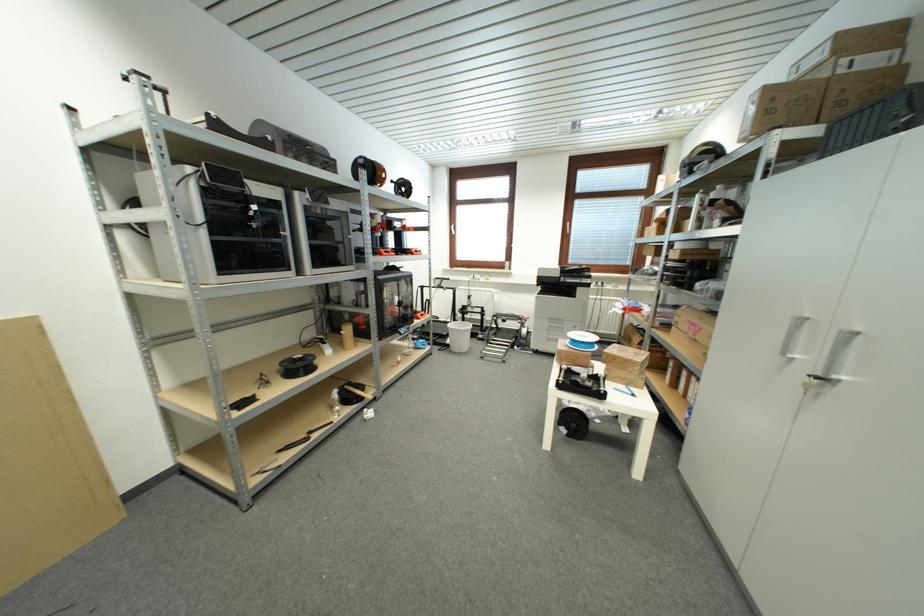
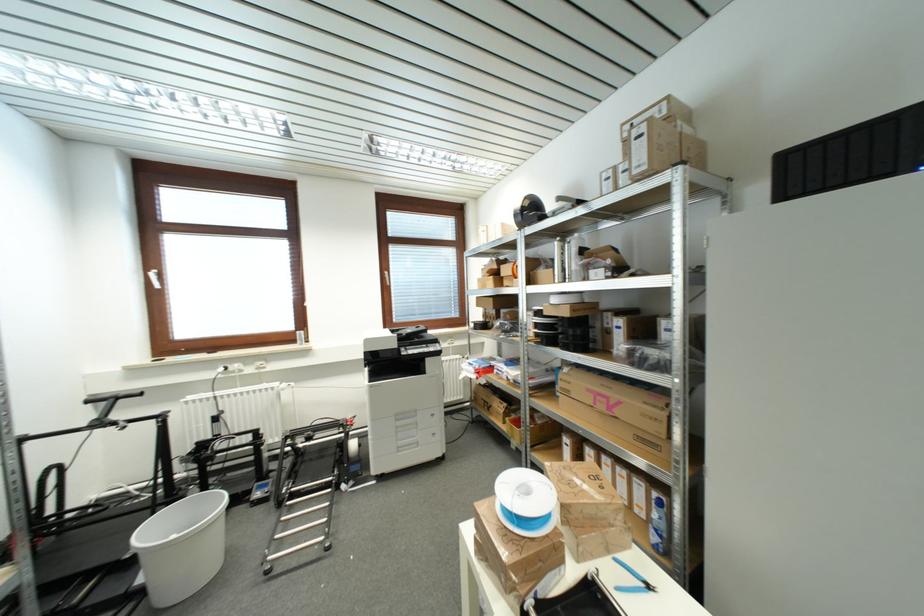
Find the pixel in the second image that matches [696,334] in the first image.

(605, 408)